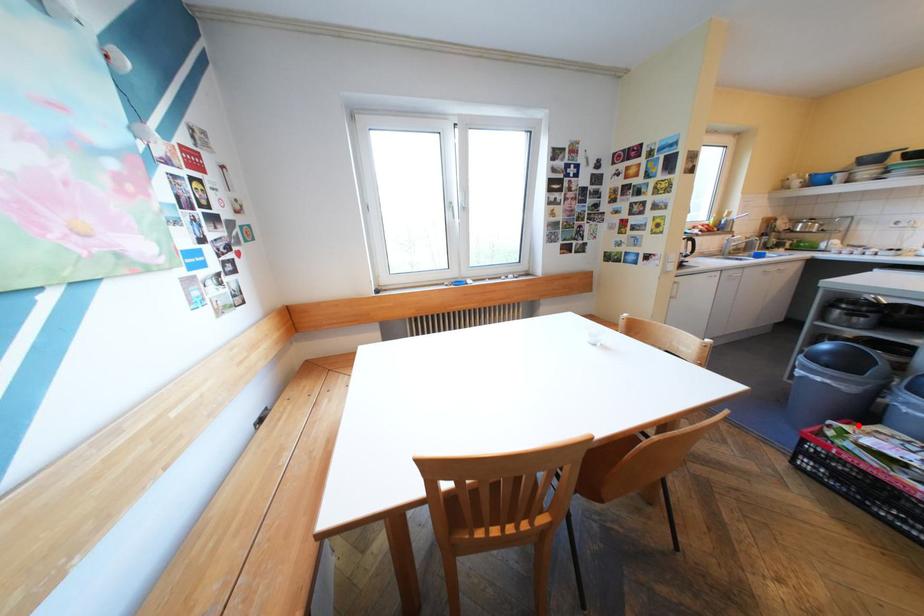
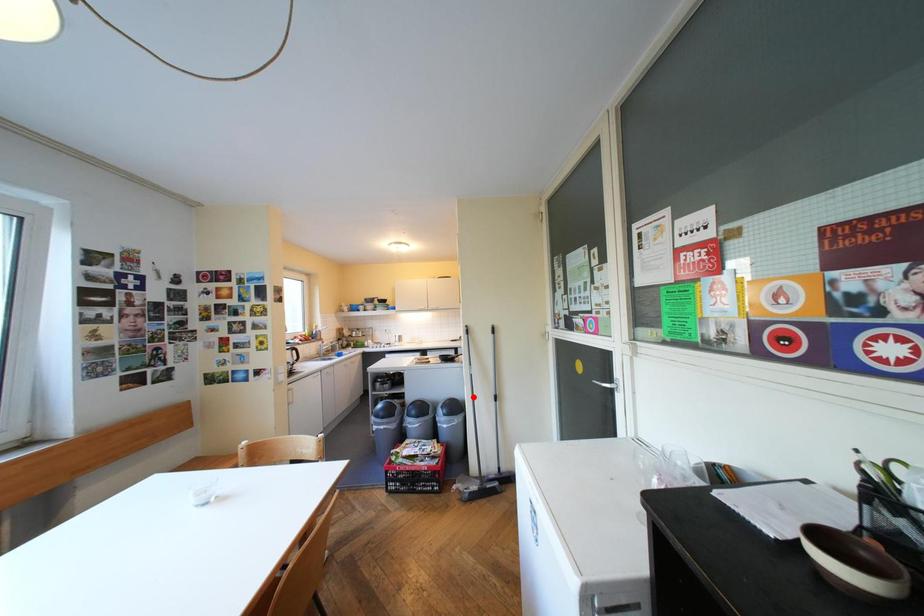
I am providing you with two images of the same scene from different viewpoints. A red point is marked on the first image and another point is marked on the second image. Is the red point in image1 aligned with the point shown in image2?

No